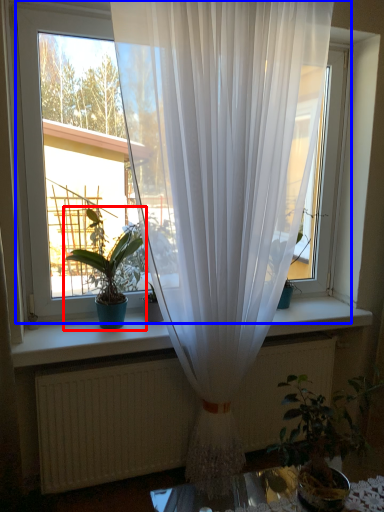
Question: Which of the following is the closest to the observer, houseplant (highlighted by a red box) or window (highlighted by a blue box)?

Choices:
 (A) houseplant
 (B) window

Answer: (B)